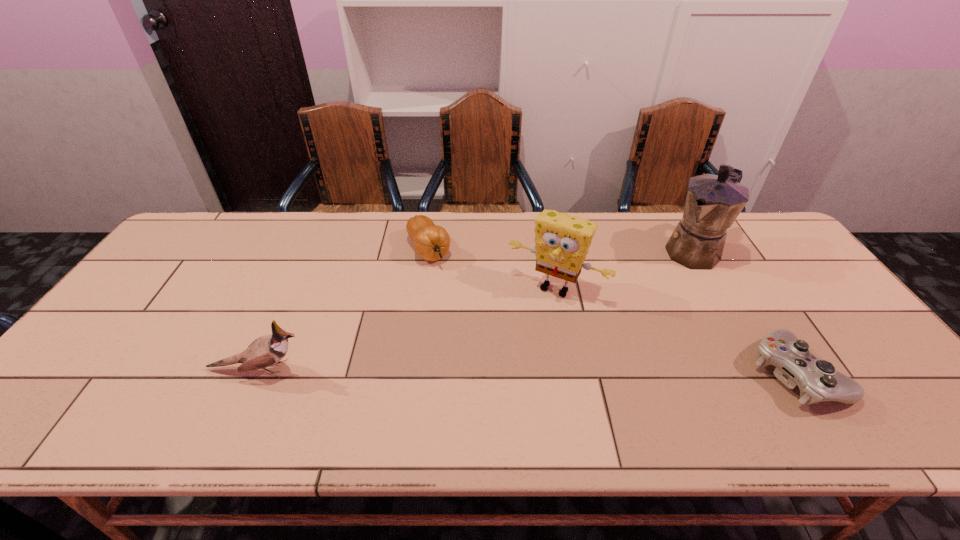
Find the location of a particular element. vacant area that lies between the shortest object and the third object from right to left is located at coordinates (676, 330).

You are a GUI agent. You are given a task and a screenshot of the screen. Output one action in this format:
    pyautogui.click(x=<x>, y=<y>)
    Task: Click on the vacant region between the shortest object and the coffeepot
    
    Given the screenshot: What is the action you would take?
    coord(746,312)

Find the location of `vacant point located between the sponge and the second object from left to right`. vacant point located between the sponge and the second object from left to right is located at coordinates (492, 268).

Where is `vacant space that is in between the tallest object and the shortest object`? vacant space that is in between the tallest object and the shortest object is located at coordinates (746, 312).

Find the location of `empty space between the control and the third shortest object`. empty space between the control and the third shortest object is located at coordinates (527, 371).

At what (x,y) coordinates should I click in order to perform the action: click on empty space between the tallest object and the leftmost object. Please return your answer as a coordinate pair (x, y). This screenshot has width=960, height=540. Looking at the image, I should click on (477, 310).

In order to click on vacant region between the fourth tallest object and the bird in this screenshot , I will do `click(344, 309)`.

I want to click on free space between the third tallest object and the sponge, so click(x=407, y=328).

This screenshot has height=540, width=960. I want to click on free space between the tallest object and the bird, so click(x=477, y=310).

Image resolution: width=960 pixels, height=540 pixels. I want to click on object that is the third closest one to the leftmost object, so [x=713, y=202].